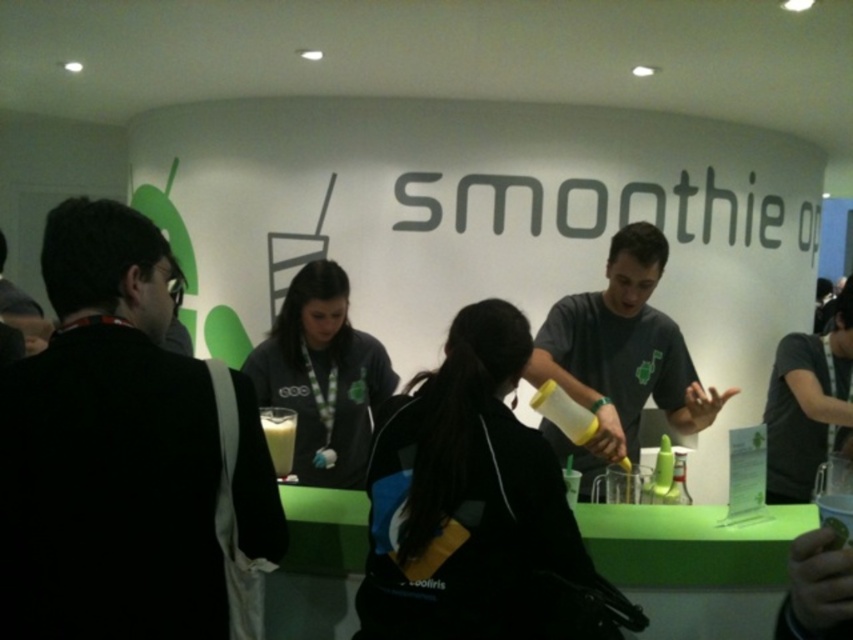
You are attending a tech event and see the black fabric jacket at left. Where exactly is it positioned in the image?

The black fabric jacket at left is located at point coordinates of 0.708 on the x axis and 0.143 on the y axis.

You are attending a tech event and notice two people at the counter. Which person is wearing the black fabric jacket at left closer to the left side compared to the matte gray shirt at center?

The black fabric jacket at left is positioned on the left side of matte gray shirt at center, so the person wearing the black fabric jacket at left is closer to the left side.